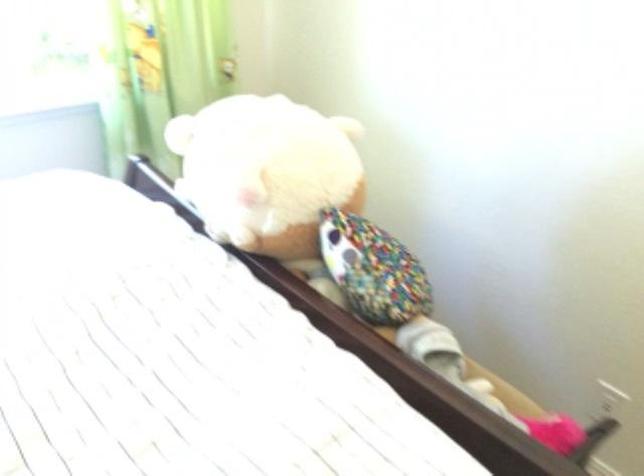
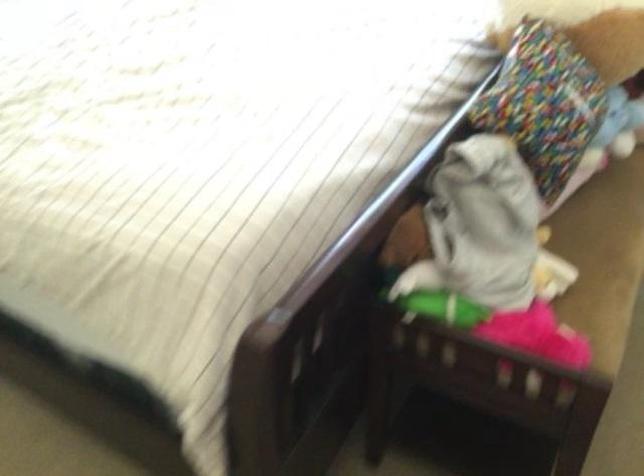
Locate, in the second image, the point that corresponds to [384,234] in the first image.

(598, 91)